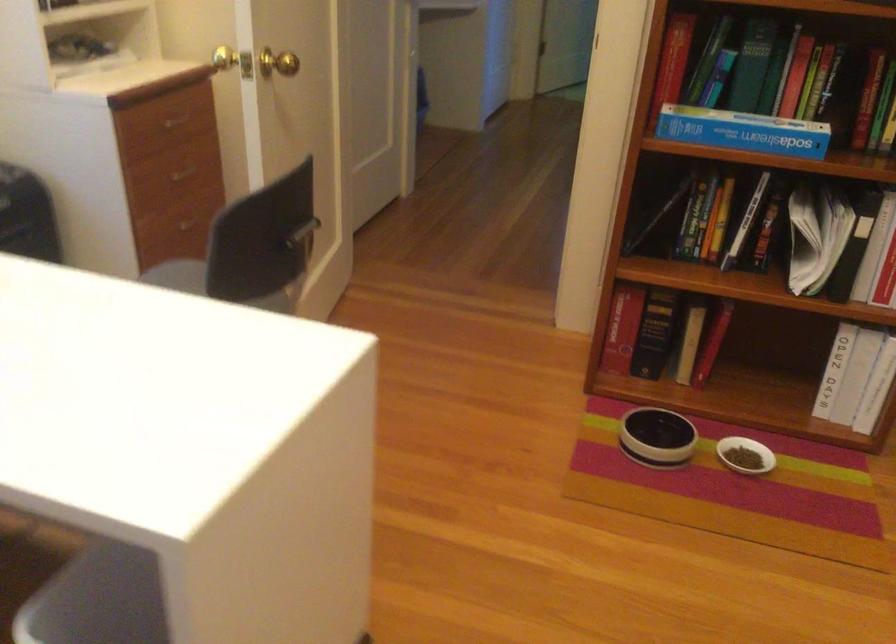
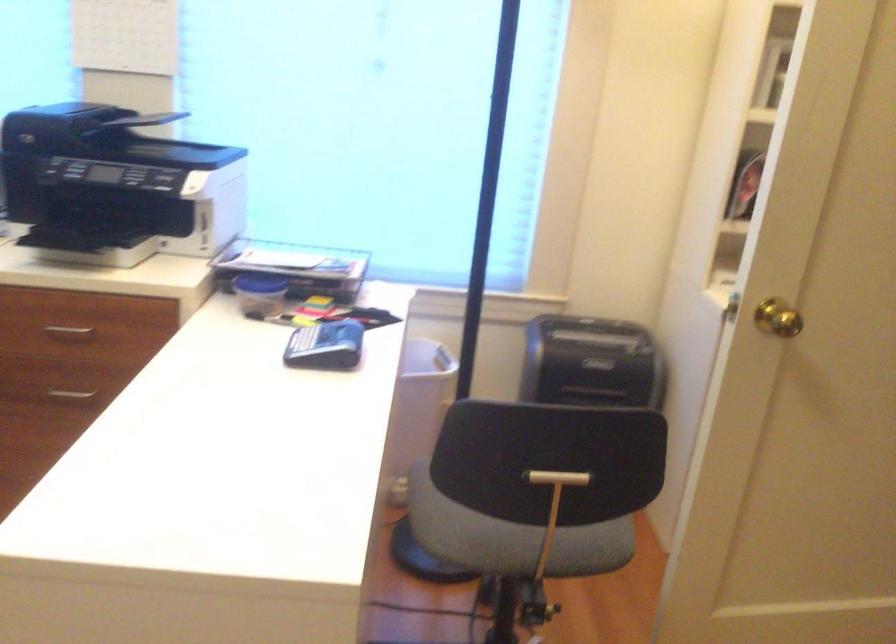
Question: I am providing you with two images of the same scene from different viewpoints. Which of the following objects are not visible in image2?

Choices:
 (A) silver drawer handle
 (B) chair sitting surface
 (C) blue handheld calculator
 (D) pink dumbbell

Answer: (B)